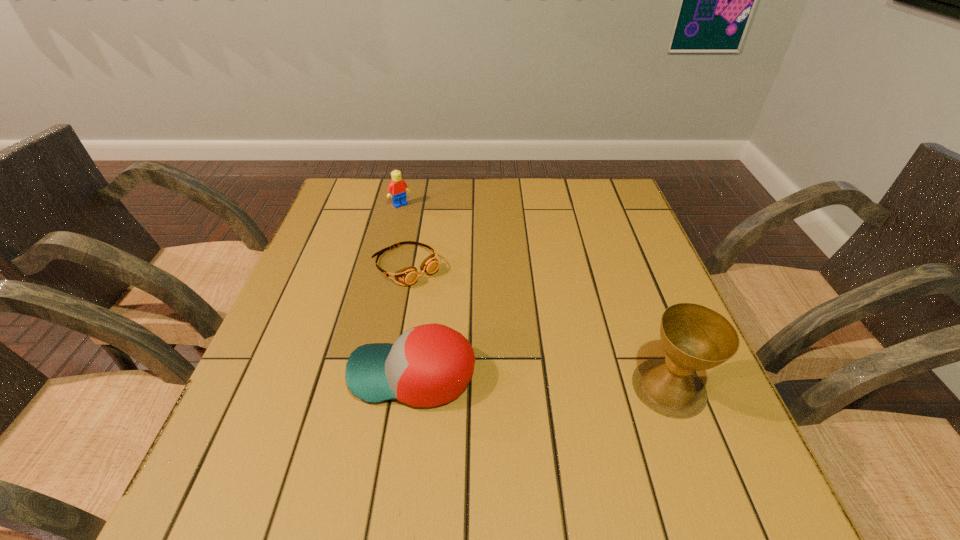
Where is `free space on the desktop that is between the baseball cap and the tallest object and is positioned on the face of the farthest object`? This screenshot has width=960, height=540. free space on the desktop that is between the baseball cap and the tallest object and is positioned on the face of the farthest object is located at coordinates (562, 382).

Where is `vacant space on the desktop that is between the baseball cap and the rightmost object and is positioned with the lenses facing forward on the third nearest object`? The image size is (960, 540). vacant space on the desktop that is between the baseball cap and the rightmost object and is positioned with the lenses facing forward on the third nearest object is located at coordinates (529, 381).